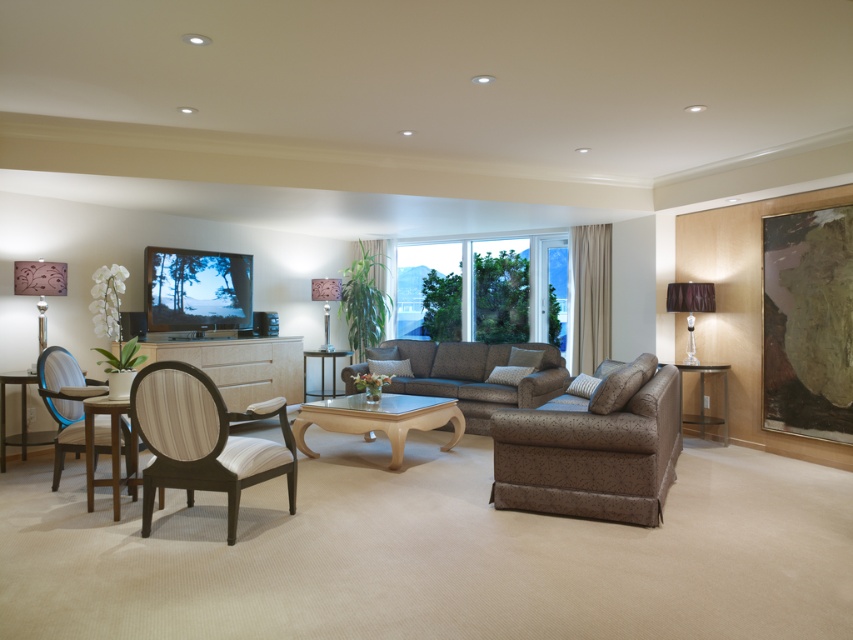
From the picture: You are planning to hang a large painting that is 1.5 meters tall on the wall. You have two options for placement in the living room scene described. The first option is above the transparent glass window at center, and the second is above the matte brown lampshade at center. Based on the height of these objects, which location would allow the painting to fit without exceeding the vertical space available?

The transparent glass window at center has a greater height compared to the matte brown lampshade at center. Therefore, placing the painting above the transparent glass window at center would provide enough vertical space for the 1.5 meters tall painting, whereas the area above the matte brown lampshade at center may be too small.

You are standing at the entrance of the living room and want to move towards the brown fabric couch at center. Based on its position coordinates, which direction should you head towards?

The brown fabric couch at center is located at coordinates point (593,449), so you should head towards the center of the room to reach it.

You are planning to place a large potted plant that requires a space of at least 1.2 meters in diameter. Looking at the wooden armchair with white cushioning at lower left and the metallic glass table at center, which object would be more suitable to position the plant next to, considering their sizes?

The wooden armchair with white cushioning at lower left has a larger size compared to the metallic glass table at center, so it would provide more space for the large potted plant requiring at least 1.2 meters in diameter.